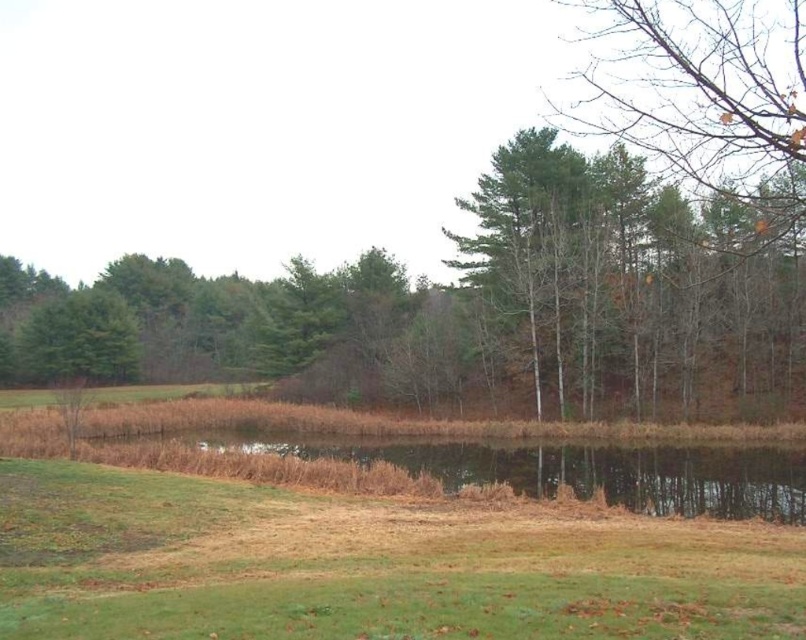
Between green grassy at lower left and brown grassy lake at center, which one is positioned lower?

brown grassy lake at center

Can you confirm if green grassy at lower left is thinner than brown grassy lake at center?

Correct, green grassy at lower left's width is less than brown grassy lake at center's.

Is point (582, 605) positioned behind point (384, 456)?

No, it is not.

Locate an element on the screen. green grassy at lower left is located at coordinates (366, 566).